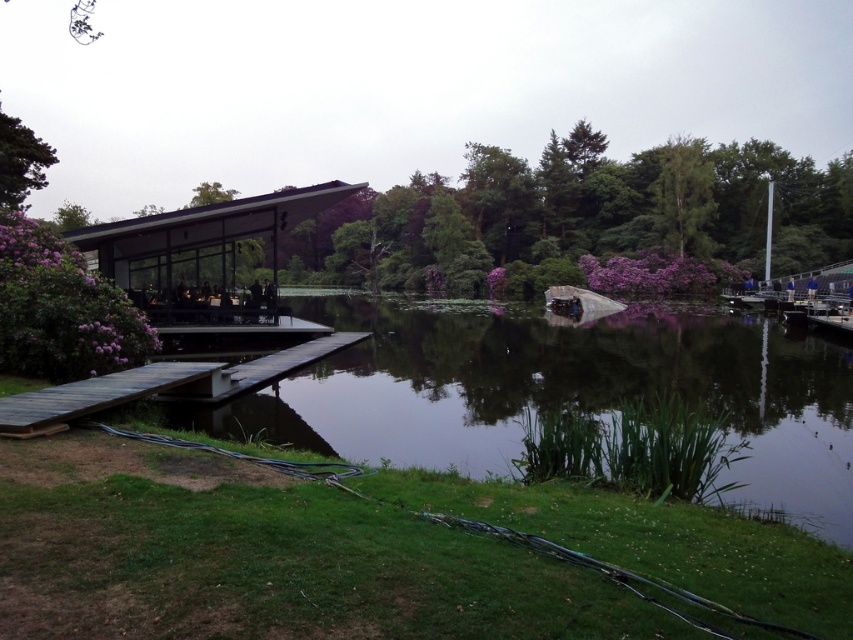
You are standing on the wooden walkway leading to the transparent glass gazebo at center. Looking up, you notice the green leafy tree at upper right. Is the tree above or below the gazebo?

The transparent glass gazebo at center is below the green leafy tree at upper right, so the tree is above the gazebo.

You are planning to take a photo of the purple leafy tree at upper center and the wooden dock at lower left from the wooden walkway. Which object will occupy more space in the photo frame?

The purple leafy tree at upper center will occupy more space in the photo frame because its width is larger than that of the wooden dock at lower left.